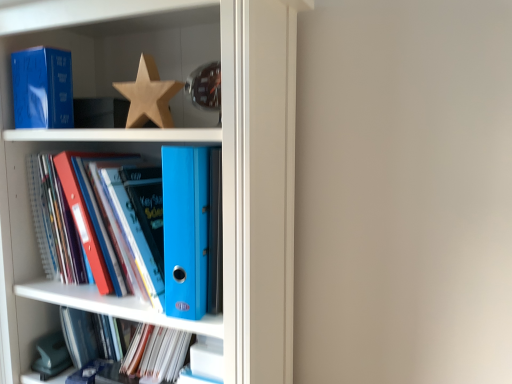
What do you see at coordinates (148, 96) in the screenshot?
I see `wooden star at upper center` at bounding box center [148, 96].

Measure the distance between point (137, 247) and camera.

32.24 inches.

Locate an element on the screen. This screenshot has height=384, width=512. matte blue binder at center is located at coordinates (159, 157).

Considering the positions of objects blue plastic ring binder at center, placed as the first book when sorted from top to bottom, and matte blue paperback book at upper left in the image provided, who is more to the left, blue plastic ring binder at center, placed as the first book when sorted from top to bottom, or matte blue paperback book at upper left?

Positioned to the left is matte blue paperback book at upper left.

Can you tell me how much blue plastic ring binder at center, the second book in the bottom-to-top sequence, and matte blue paperback book at upper left differ in facing direction?

2.69 degrees.

Could you tell me if blue plastic ring binder at center, placed as the first book when sorted from top to bottom, is turned towards matte blue paperback book at upper left?

No, blue plastic ring binder at center, placed as the first book when sorted from top to bottom, does not turn towards matte blue paperback book at upper left.

Would you say blue plastic ring binder at center, placed as the first book when sorted from top to bottom, is inside or outside matte blue paperback book at upper left?

blue plastic ring binder at center, placed as the first book when sorted from top to bottom, is spatially situated outside matte blue paperback book at upper left.

From a real-world perspective, who is located lower, wooden star at upper center or matte blue folder at lower center, placed as the second book when sorted from top to bottom?

From a 3D spatial view, matte blue folder at lower center, placed as the second book when sorted from top to bottom, is below.

How many degrees apart are the facing directions of wooden star at upper center and matte blue folder at lower center, the first book ordered from the bottom?

0.119 degrees.

Considering the sizes of objects wooden star at upper center and matte blue folder at lower center, the first book ordered from the bottom, in the image provided, who is shorter, wooden star at upper center or matte blue folder at lower center, the first book ordered from the bottom,?

With less height is matte blue folder at lower center, the first book ordered from the bottom.

Is matte blue folder at lower center, placed as the second book when sorted from top to bottom, positioned beyond the bounds of wooden star at upper center?

Yes.

Which of these two, matte blue folder at lower center, placed as the second book when sorted from top to bottom, or wooden star at upper center, is wider?

With larger width is matte blue folder at lower center, placed as the second book when sorted from top to bottom.

Can you confirm if matte blue folder at lower center, placed as the second book when sorted from top to bottom, is bigger than wooden star at upper center?

Indeed, matte blue folder at lower center, placed as the second book when sorted from top to bottom, has a larger size compared to wooden star at upper center.

From a real-world perspective, is matte blue folder at lower center, the first book ordered from the bottom, over wooden star at upper center?

No, from a real-world perspective, matte blue folder at lower center, the first book ordered from the bottom, is not on top of wooden star at upper center.

From a real-world perspective, relative to blue plastic ring binder at center, the second book in the bottom-to-top sequence, is matte blue folder at lower center, placed as the second book when sorted from top to bottom, vertically above or below?

In terms of real-world spatial position, matte blue folder at lower center, placed as the second book when sorted from top to bottom, is below blue plastic ring binder at center, the second book in the bottom-to-top sequence.

Can you see matte blue folder at lower center, placed as the second book when sorted from top to bottom, touching blue plastic ring binder at center, the second book in the bottom-to-top sequence?

matte blue folder at lower center, placed as the second book when sorted from top to bottom, and blue plastic ring binder at center, the second book in the bottom-to-top sequence, are not in contact.

Considering the points (129, 362) and (164, 292), which point is in front, point (129, 362) or point (164, 292)?

The point (164, 292) is closer to the camera.

Where is `book above the matte blue folder at lower center, the first book ordered from the bottom (from the image's perspective)`? This screenshot has height=384, width=512. book above the matte blue folder at lower center, the first book ordered from the bottom (from the image's perspective) is located at coordinates (99, 226).

Is matte blue paperback book at upper left looking in the opposite direction of wooden star at upper center?

matte blue paperback book at upper left does not have its back to wooden star at upper center.

Considering the relative sizes of matte blue paperback book at upper left and wooden star at upper center in the image provided, is matte blue paperback book at upper left bigger than wooden star at upper center?

Yes.

Is matte blue paperback book at upper left located outside wooden star at upper center?

Yes.

Would you consider matte blue paperback book at upper left to be distant from wooden star at upper center?

No, matte blue paperback book at upper left is not far from wooden star at upper center.

Between wooden star at upper center and matte blue binder at center, which one has less height?

Standing shorter between the two is wooden star at upper center.

Looking at this image, which is less distant, (179, 90) or (274, 368)?

Clearly, point (179, 90) is closer to the camera than point (274, 368).

Is matte blue binder at center a part of wooden star at upper center?

No, wooden star at upper center does not contain matte blue binder at center.

Which object is closer to the camera taking this photo, wooden star at upper center or matte blue binder at center?

matte blue binder at center is more forward.

Considering the relative sizes of wooden star at upper center and blue plastic ring binder at center, placed as the first book when sorted from top to bottom, in the image provided, is wooden star at upper center shorter than blue plastic ring binder at center, placed as the first book when sorted from top to bottom,?

Correct, wooden star at upper center is not as tall as blue plastic ring binder at center, placed as the first book when sorted from top to bottom.

From a real-world perspective, who is located higher, wooden star at upper center or blue plastic ring binder at center, placed as the first book when sorted from top to bottom?

From a 3D spatial view, wooden star at upper center is above.

Considering the positions of point (142, 68) and point (149, 171), is point (142, 68) closer or farther from the camera than point (149, 171)?

Point (142, 68).

Are wooden star at upper center and blue plastic ring binder at center, the second book in the bottom-to-top sequence, far apart?

That's not correct — wooden star at upper center is a little close to blue plastic ring binder at center, the second book in the bottom-to-top sequence.

There is a blue plastic ring binder at center, placed as the first book when sorted from top to bottom. Find the location of `paperback book above it (from a real-world perspective)`. paperback book above it (from a real-world perspective) is located at coordinates (42, 88).

The height and width of the screenshot is (384, 512). Identify the location of the 1st book in front when counting from the wooden star at upper center. (156, 353).

Looking at the image, which one is located further to matte blue binder at center, wooden star at upper center or blue plastic ring binder at center, placed as the first book when sorted from top to bottom?

wooden star at upper center.

Considering their positions, is matte blue binder at center positioned closer to matte blue folder at lower center, the first book ordered from the bottom, than matte blue paperback book at upper left?

Among the two, matte blue binder at center is located nearer to matte blue folder at lower center, the first book ordered from the bottom.

When comparing their distances from wooden star at upper center, does matte blue binder at center or matte blue folder at lower center, the first book ordered from the bottom, seem closer?

Based on the image, matte blue binder at center appears to be nearer to wooden star at upper center.

Based on their spatial positions, is matte blue folder at lower center, placed as the second book when sorted from top to bottom, or matte blue binder at center closer to blue plastic ring binder at center, the second book in the bottom-to-top sequence?

The object closer to blue plastic ring binder at center, the second book in the bottom-to-top sequence, is matte blue binder at center.

When comparing their distances from matte blue binder at center, does matte blue folder at lower center, placed as the second book when sorted from top to bottom, or wooden star at upper center seem closer?

Among the two, wooden star at upper center is located nearer to matte blue binder at center.

Looking at the image, which one is located closer to matte blue paperback book at upper left, matte blue folder at lower center, the first book ordered from the bottom, or wooden star at upper center?

Based on the image, wooden star at upper center appears to be nearer to matte blue paperback book at upper left.

Considering their positions, is matte blue binder at center positioned closer to matte blue folder at lower center, the first book ordered from the bottom, than blue plastic ring binder at center, the second book in the bottom-to-top sequence?

blue plastic ring binder at center, the second book in the bottom-to-top sequence.

Considering their positions, is matte blue paperback book at upper left positioned closer to matte blue folder at lower center, the first book ordered from the bottom, than blue plastic ring binder at center, placed as the first book when sorted from top to bottom?

blue plastic ring binder at center, placed as the first book when sorted from top to bottom, is closer to matte blue folder at lower center, the first book ordered from the bottom.

The width and height of the screenshot is (512, 384). In order to click on book that lies between wooden star at upper center and matte blue folder at lower center, placed as the second book when sorted from top to bottom, from top to bottom in this screenshot , I will do `click(99, 226)`.

The height and width of the screenshot is (384, 512). I want to click on star that lies between matte blue paperback book at upper left and blue plastic ring binder at center, the second book in the bottom-to-top sequence, from top to bottom, so click(x=148, y=96).

You are a GUI agent. You are given a task and a screenshot of the screen. Output one action in this format:
    pyautogui.click(x=<x>, y=<y>)
    Task: Click on the book between wooden star at upper center and matte blue binder at center in the vertical direction
    The image size is (512, 384).
    Given the screenshot: What is the action you would take?
    pyautogui.click(x=99, y=226)

At what (x,y) coordinates should I click in order to perform the action: click on bookcase that lies between matte blue paperback book at upper left and matte blue folder at lower center, the first book ordered from the bottom, from top to bottom. Please return your answer as a coordinate pair (x, y). The height and width of the screenshot is (384, 512). Looking at the image, I should click on (159, 157).